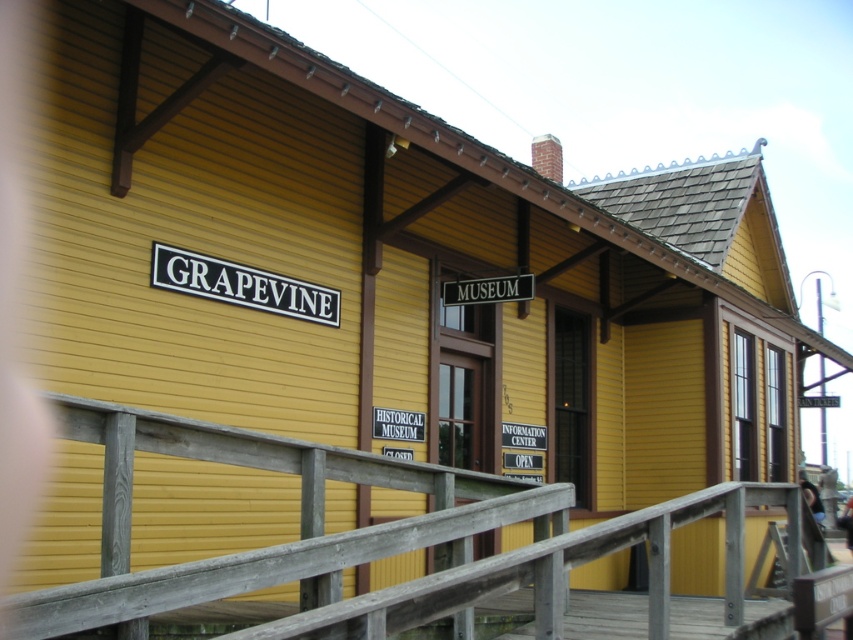
The width and height of the screenshot is (853, 640). I want to click on wooden at center, so click(x=375, y=540).

Can you confirm if wooden at center is wider than black metal sign at center?

Indeed, wooden at center has a greater width compared to black metal sign at center.

Between point (305, 512) and point (515, 284), which one is positioned in front?

Point (305, 512) is in front.

Where is `wooden at center`? wooden at center is located at coordinates (375, 540).